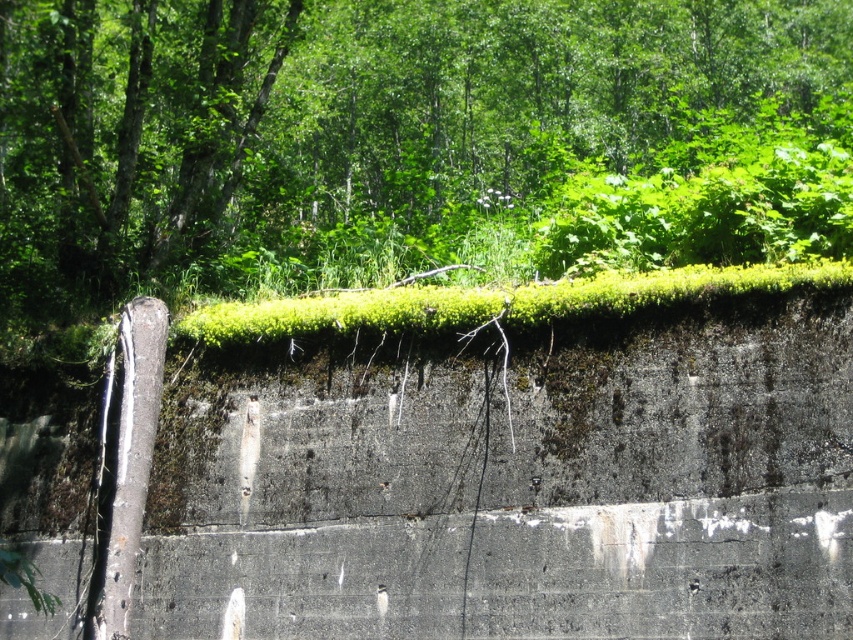
Question: Which object is closer to the camera taking this photo?

Choices:
 (A) green mossy concrete at upper center
 (B) green leafy tree at upper center

Answer: (A)

Question: Does green mossy concrete at upper center appear on the right side of green leafy tree at upper center?

Choices:
 (A) yes
 (B) no

Answer: (B)

Question: Among these objects, which one is nearest to the camera?

Choices:
 (A) green leafy tree at upper center
 (B) green mossy concrete at upper center

Answer: (B)

Question: Is green mossy concrete at upper center positioned before green leafy tree at upper center?

Choices:
 (A) yes
 (B) no

Answer: (A)

Question: Which point is farther to the camera?

Choices:
 (A) (804, 106)
 (B) (561, 605)

Answer: (A)

Question: Does green mossy concrete at upper center appear on the right side of green leafy tree at upper center?

Choices:
 (A) no
 (B) yes

Answer: (A)